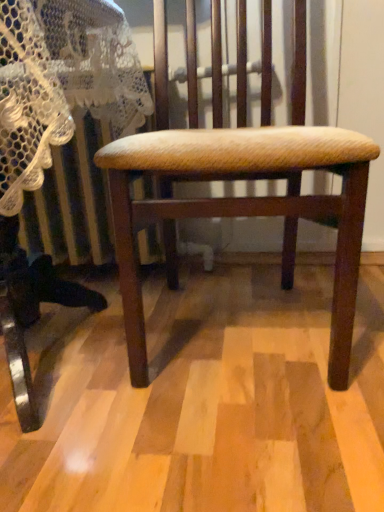
Question: Can you confirm if wooden chair at center is wider than wooden textured stool at center?

Choices:
 (A) no
 (B) yes

Answer: (A)

Question: Is wooden chair at center far away from wooden textured stool at center?

Choices:
 (A) no
 (B) yes

Answer: (A)

Question: From the image's perspective, is wooden chair at center over wooden textured stool at center?

Choices:
 (A) no
 (B) yes

Answer: (B)

Question: Is wooden textured stool at center completely or partially inside wooden chair at center?

Choices:
 (A) yes
 (B) no

Answer: (B)

Question: Considering the relative positions of wooden chair at center and wooden textured stool at center in the image provided, is wooden chair at center in front of wooden textured stool at center?

Choices:
 (A) yes
 (B) no

Answer: (B)

Question: Can you confirm if wooden chair at center is thinner than wooden textured stool at center?

Choices:
 (A) yes
 (B) no

Answer: (A)

Question: Is wooden textured stool at center bigger than wooden chair at center?

Choices:
 (A) no
 (B) yes

Answer: (B)

Question: Is wooden textured stool at center facing towards wooden chair at center?

Choices:
 (A) no
 (B) yes

Answer: (A)

Question: Is the position of wooden textured stool at center less distant than that of wooden chair at center?

Choices:
 (A) yes
 (B) no

Answer: (A)

Question: Is wooden textured stool at center turned away from wooden chair at center?

Choices:
 (A) no
 (B) yes

Answer: (A)

Question: Are wooden textured stool at center and wooden chair at center far apart?

Choices:
 (A) no
 (B) yes

Answer: (A)

Question: Is wooden textured stool at center beside wooden chair at center?

Choices:
 (A) no
 (B) yes

Answer: (A)

Question: Considering the positions of point (322, 141) and point (8, 264), is point (322, 141) closer or farther from the camera than point (8, 264)?

Choices:
 (A) farther
 (B) closer

Answer: (B)